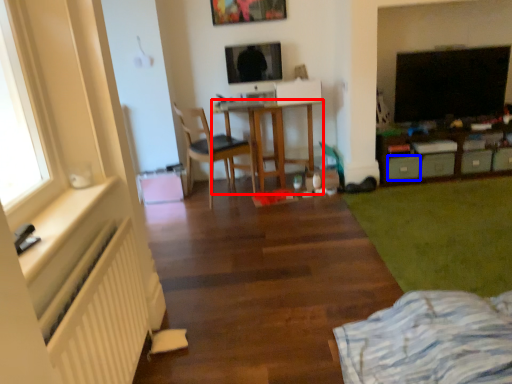
Question: Which point is closer to the camera, desk (highlighted by a red box) or drawer (highlighted by a blue box)?

Choices:
 (A) desk
 (B) drawer

Answer: (A)